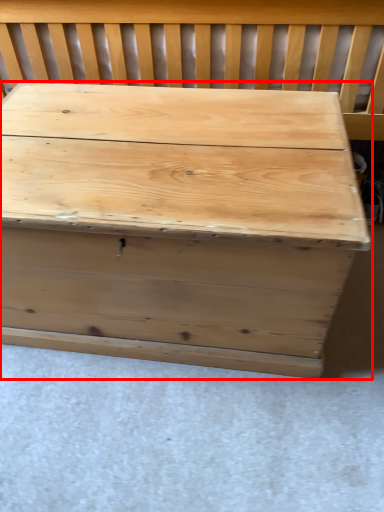
Question: Considering the relative positions of table (annotated by the red box) and church bench in the image provided, where is table (annotated by the red box) located with respect to the staircase?

Choices:
 (A) right
 (B) left

Answer: (B)